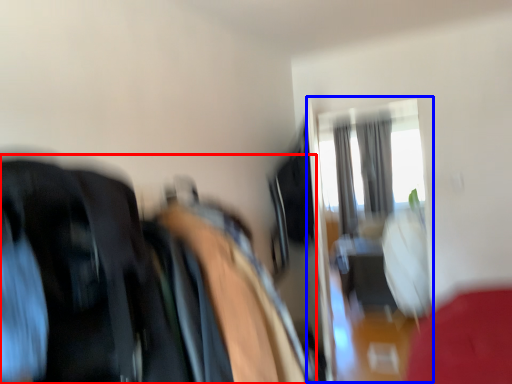
Question: Which point is further to the camera, laundry (highlighted by a red box) or glass door (highlighted by a blue box)?

Choices:
 (A) laundry
 (B) glass door

Answer: (B)